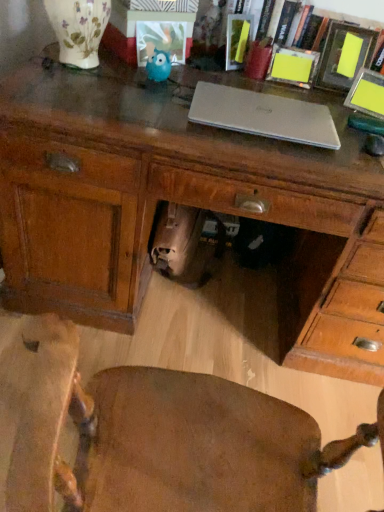
This screenshot has width=384, height=512. I want to click on free point above silver metallic laptop at center (from a real-world perspective), so click(263, 110).